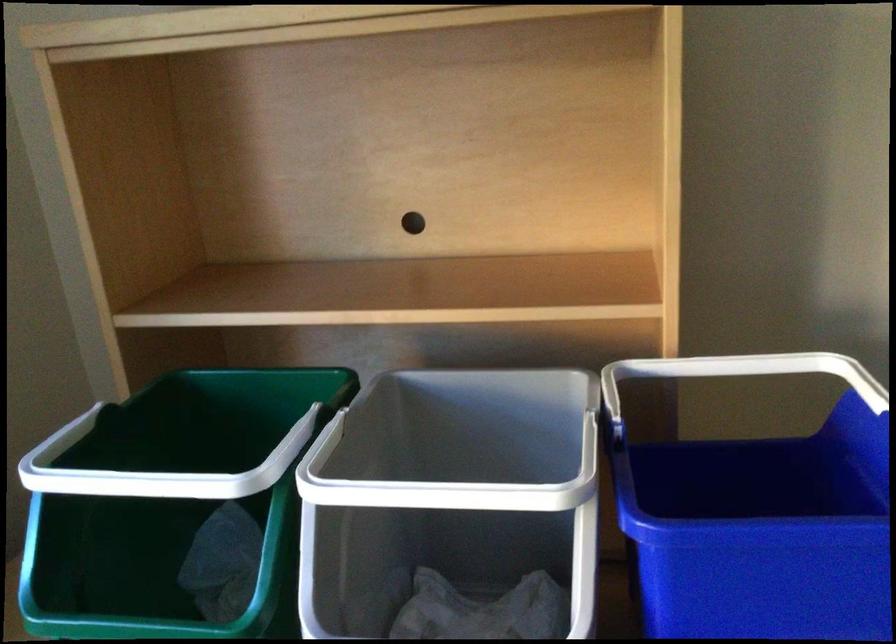
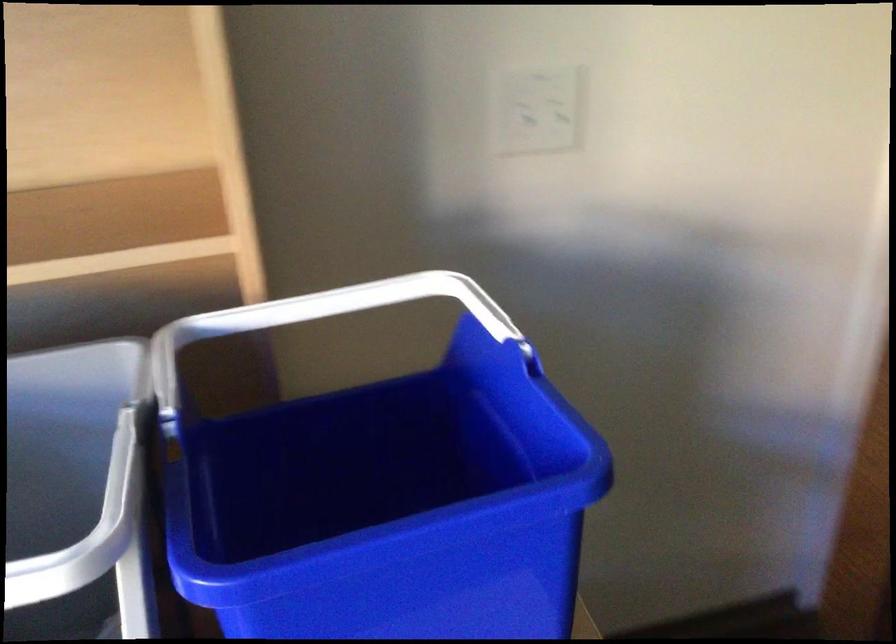
What movement of the cameraman would produce the second image?

The cameraman moved toward right, forward.